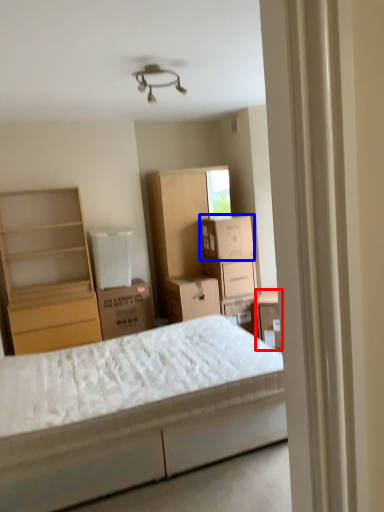
Question: Which point is further to the camera, storage box (highlighted by a red box) or cardboard box (highlighted by a blue box)?

Choices:
 (A) storage box
 (B) cardboard box

Answer: (B)